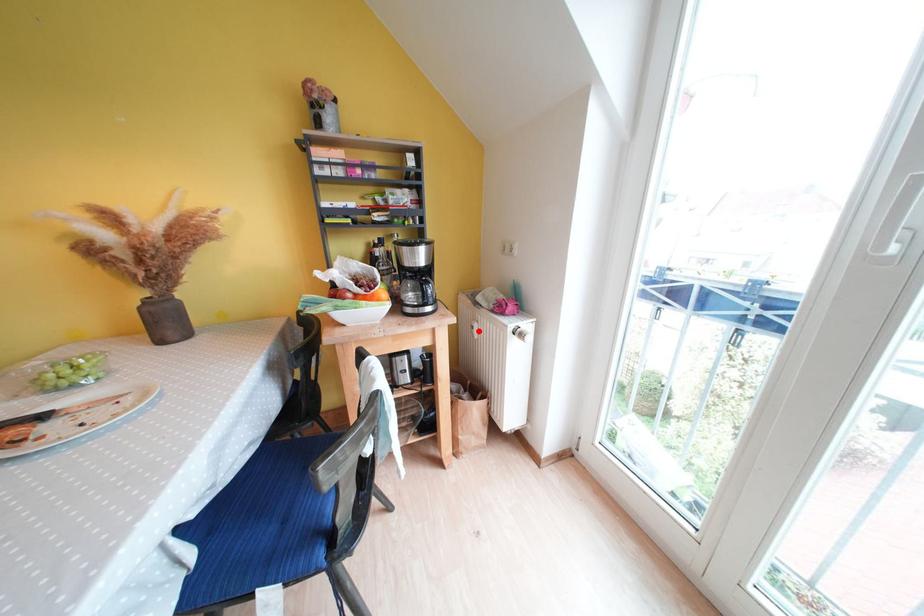
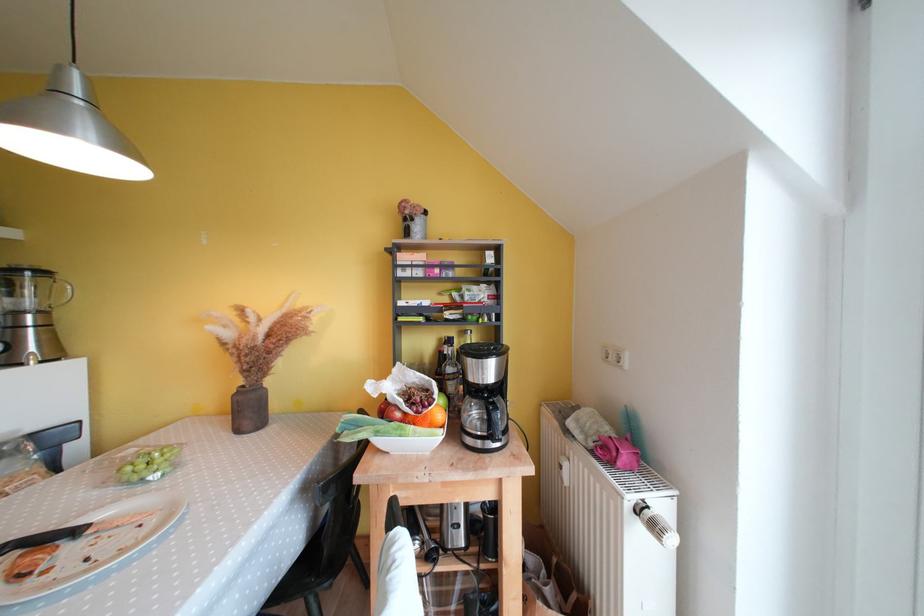
Locate, in the second image, the point that corresponds to the highlighted location in the first image.

(566, 471)